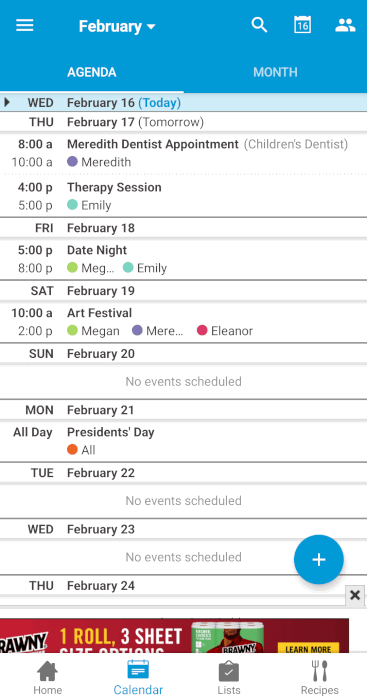
Identify the location of calendar. The height and width of the screenshot is (700, 367). (139, 668).